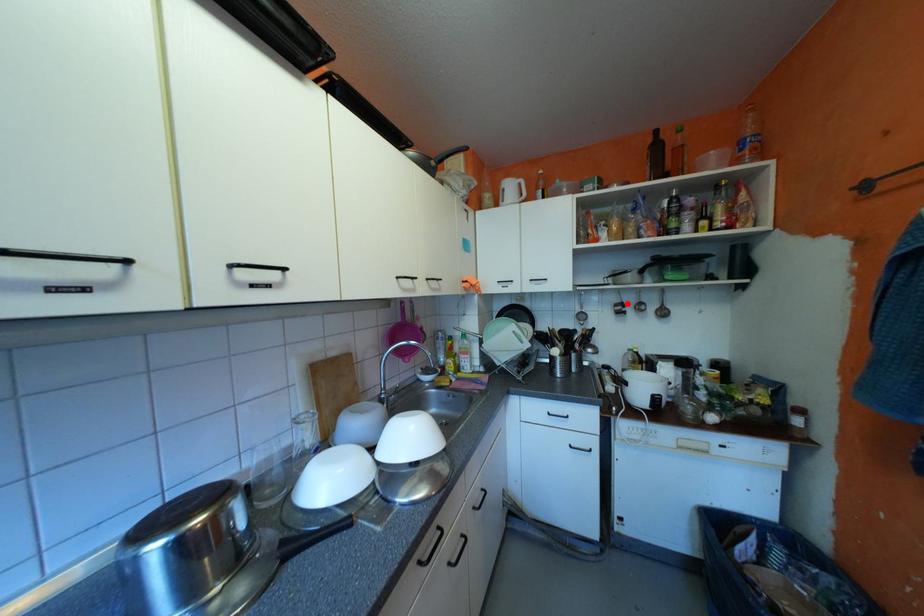
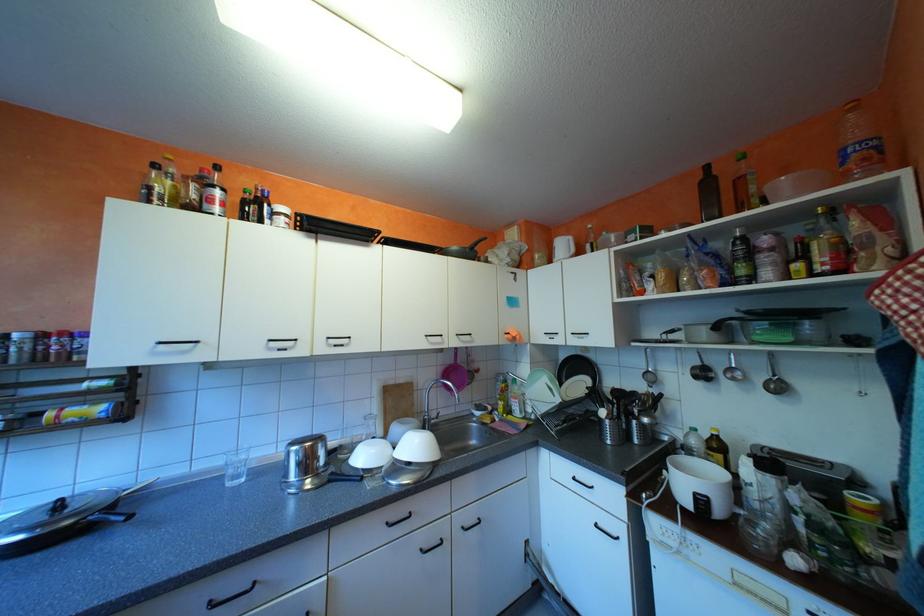
Locate, in the second image, the point that corresponds to the highlighted location in the first image.

(706, 367)